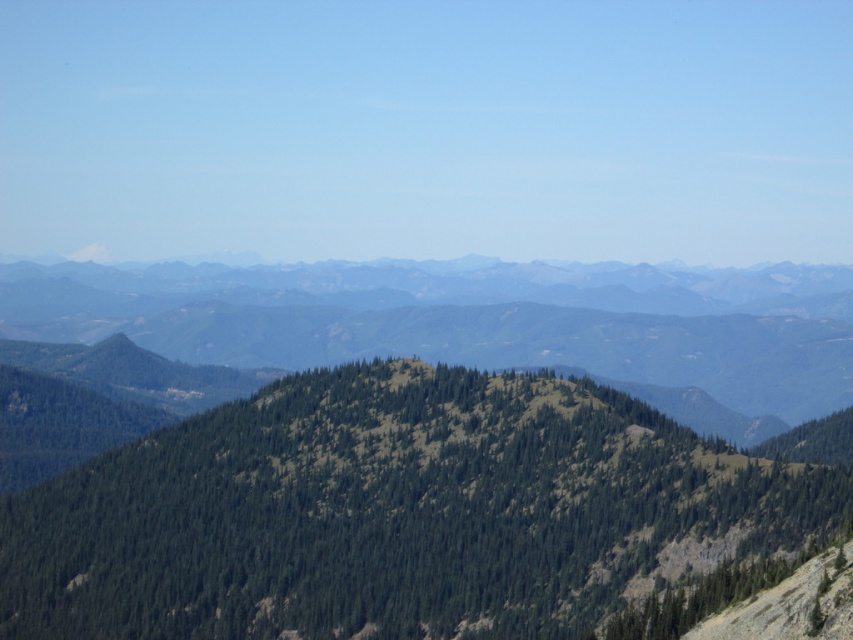
Question: Can you confirm if green textured mountain at center is positioned to the right of green textured mountain range at center?

Choices:
 (A) no
 (B) yes

Answer: (B)

Question: Can you confirm if green textured mountain at center is thinner than green textured mountain range at center?

Choices:
 (A) yes
 (B) no

Answer: (A)

Question: Which of the following is the farthest from the observer?

Choices:
 (A) green textured mountain at center
 (B) green textured mountain range at center

Answer: (B)

Question: Does green textured mountain at center have a greater width compared to green textured mountain range at center?

Choices:
 (A) no
 (B) yes

Answer: (A)

Question: Which point is closer to the camera taking this photo?

Choices:
 (A) (331, 467)
 (B) (387, 276)

Answer: (A)

Question: Which point is farther to the camera?

Choices:
 (A) green textured mountain range at center
 (B) green textured mountain at center

Answer: (A)